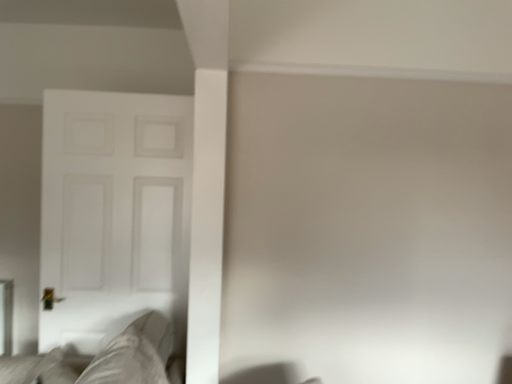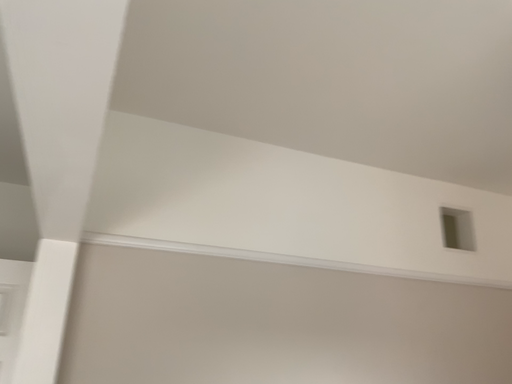
Question: How did the camera likely rotate when shooting the video?

Choices:
 (A) rotated right
 (B) rotated left

Answer: (A)